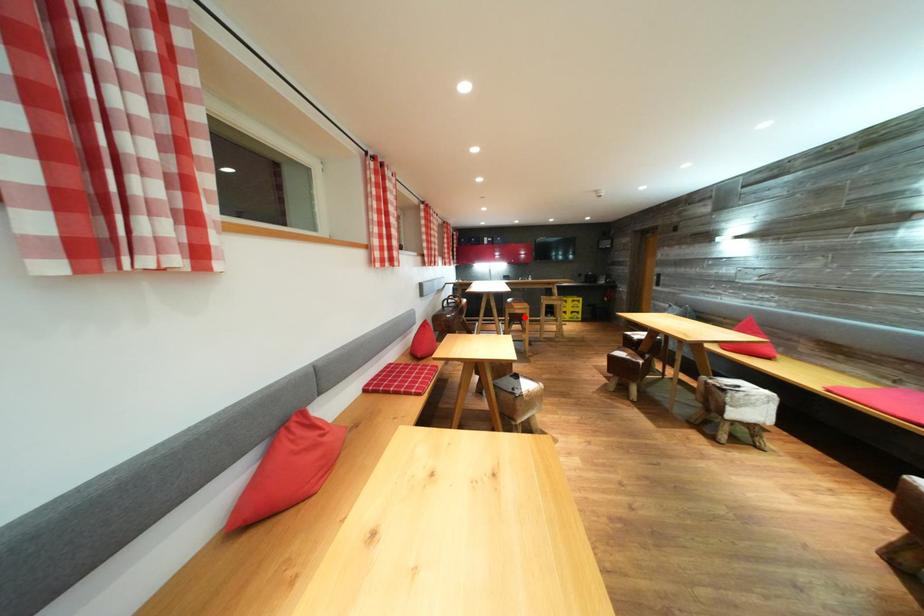
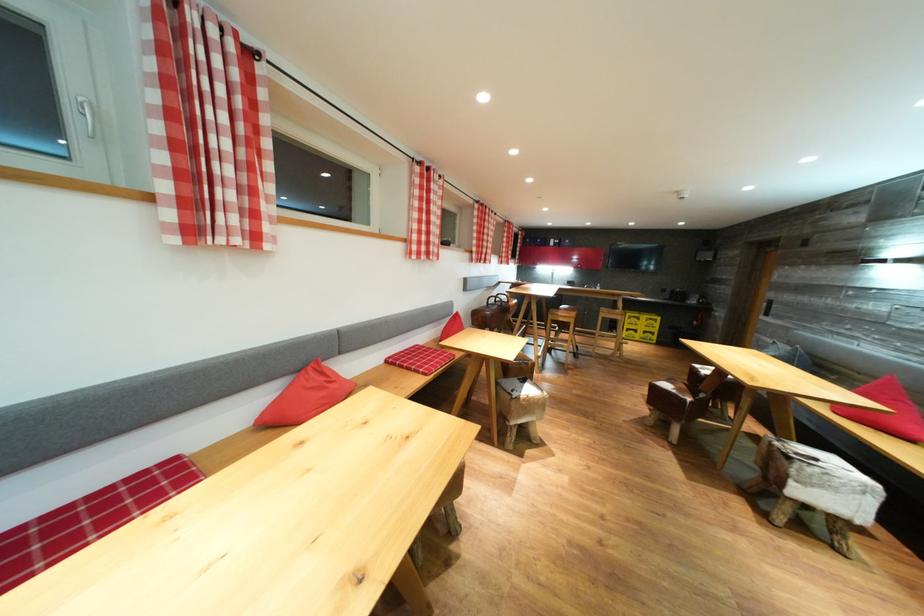
Question: A red point is marked in image1. In image2, is the corresponding 3D point closer to the camera or farther? Reply with the corresponding letter.

Choices:
 (A) The corresponding 3D point is closer.
 (B) The corresponding 3D point is farther.

Answer: (A)